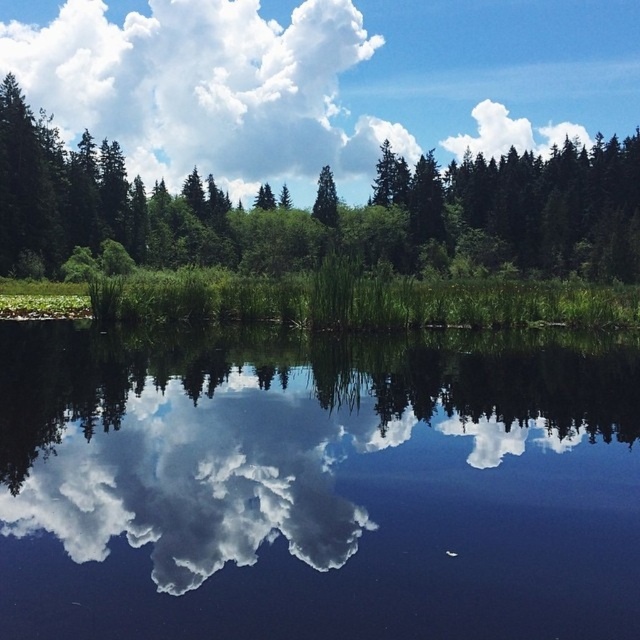
Can you confirm if transparent water at center is taller than white fluffy cloud at upper center?

Incorrect, transparent water at center's height is not larger of white fluffy cloud at upper center's.

Which is more to the right, transparent water at center or white fluffy cloud at upper center?

From the viewer's perspective, transparent water at center appears more on the right side.

Is point (160, 397) positioned behind point (164, 35)?

No, (160, 397) is in front of (164, 35).

What are the coordinates of `transparent water at center` in the screenshot? It's located at 317,488.

Is green leafy trees at upper center smaller than green matte tree at center?

Actually, green leafy trees at upper center might be larger than green matte tree at center.

Is green leafy trees at upper center positioned before green matte tree at center?

Yes, it is in front of green matte tree at center.

Who is more distant from viewer, (481,236) or (317,209)?

Point (317,209)

At what (x,y) coordinates should I click in order to perform the action: click on green leafy trees at upper center. Please return your answer as a coordinate pair (x, y). Image resolution: width=640 pixels, height=640 pixels. Looking at the image, I should click on (310, 212).

Who is positioned more to the left, green leafy trees at upper center or white fluffy cloud at upper center?

white fluffy cloud at upper center is more to the left.

Does green leafy trees at upper center appear on the right side of white fluffy cloud at upper center?

Yes, green leafy trees at upper center is to the right of white fluffy cloud at upper center.

You are a GUI agent. You are given a task and a screenshot of the screen. Output one action in this format:
    pyautogui.click(x=<x>, y=<y>)
    Task: Click on the green leafy trees at upper center
    The width and height of the screenshot is (640, 640).
    Given the screenshot: What is the action you would take?
    pyautogui.click(x=310, y=212)